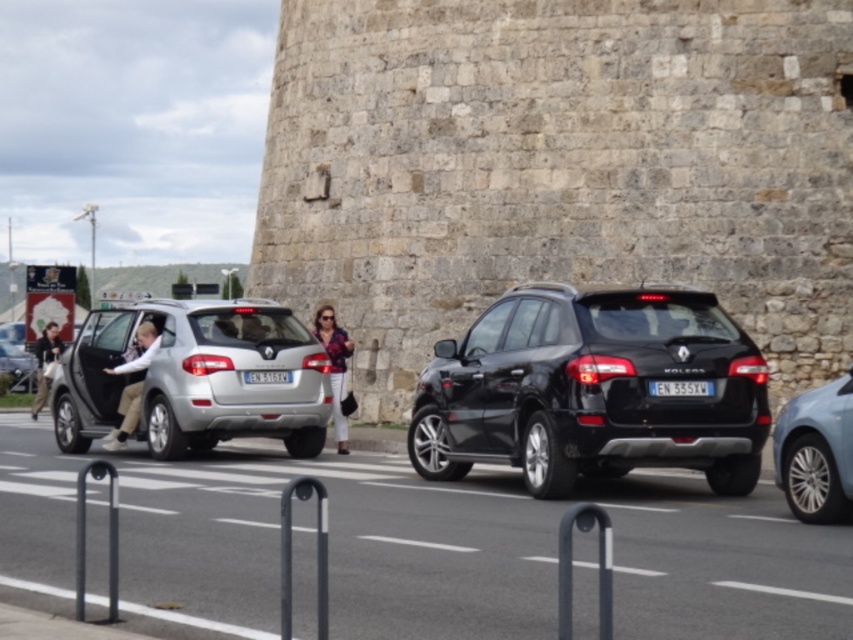
Question: Which of the following is the farthest from the observer?

Choices:
 (A) (164, 301)
 (B) (712, 394)
 (C) (270, 378)

Answer: (A)

Question: Which is nearer to the denim jacket at center?

Choices:
 (A) black plastic license plate at center
 (B) black glossy suv at center
 (C) light brown leather jacket at left
 (D) light blue denim jeans at left

Answer: (D)

Question: Is black glossy suv at center to the left of light blue denim jeans at left from the viewer's perspective?

Choices:
 (A) yes
 (B) no

Answer: (B)

Question: Observing the image, what is the correct spatial positioning of stone textured fort at center in reference to denim jacket at center?

Choices:
 (A) right
 (B) left

Answer: (A)

Question: Estimate the real-world distances between objects in this image. Which object is closer to the light blue metallic sedan at right?

Choices:
 (A) silver metallic hatchback at left
 (B) light blue denim jeans at left

Answer: (B)

Question: Does stone textured fort at center appear under black plastic license plate at center?

Choices:
 (A) no
 (B) yes

Answer: (A)